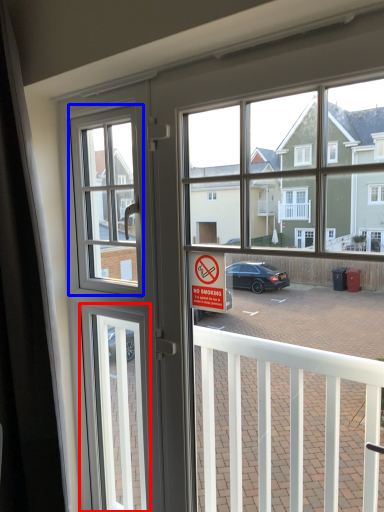
Question: Which object appears closest to the camera in this image, screen door (highlighted by a red box) or window screen (highlighted by a blue box)?

Choices:
 (A) screen door
 (B) window screen

Answer: (B)